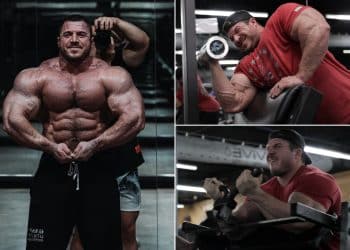
Identify the location of handles. (222, 185), (234, 190).